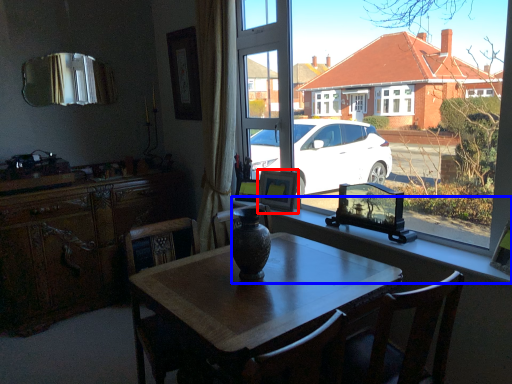
Question: Which point is further to the camera, picture frame (highlighted by a red box) or window sill (highlighted by a blue box)?

Choices:
 (A) picture frame
 (B) window sill

Answer: (A)